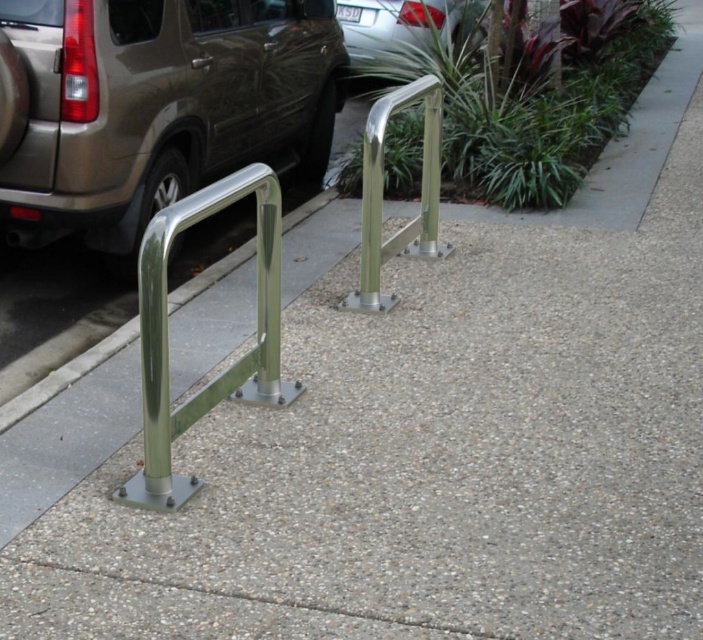
Does polished stainless steel bike rack at center appear on the right side of polished stainless steel handrail at center?

In fact, polished stainless steel bike rack at center is to the left of polished stainless steel handrail at center.

Which is in front, point (146, 282) or point (446, 244)?

Point (146, 282)

You are a GUI agent. You are given a task and a screenshot of the screen. Output one action in this format:
    pyautogui.click(x=<x>, y=<y>)
    Task: Click on the polished stainless steel bike rack at center
    This screenshot has width=703, height=640.
    Given the screenshot: What is the action you would take?
    pyautogui.click(x=167, y=333)

Between point (11, 72) and point (153, 376), which one is positioned in front?

Point (153, 376) is in front.

Who is positioned more to the right, satin silver minivan at left or polished stainless steel bike rack at center?

polished stainless steel bike rack at center is more to the right.

Where is `satin silver minivan at left`? This screenshot has height=640, width=703. satin silver minivan at left is located at coordinates (154, 106).

How distant is polished stainless steel bike rack at center from silver metallic car at upper center?

polished stainless steel bike rack at center and silver metallic car at upper center are 4.96 meters apart from each other.

From the picture: Is polished stainless steel bike rack at center further to camera compared to silver metallic car at upper center?

No, polished stainless steel bike rack at center is in front of silver metallic car at upper center.

Find the location of a particular element. polished stainless steel bike rack at center is located at coordinates (167, 333).

At what (x,y) coordinates should I click in order to perform the action: click on polished stainless steel bike rack at center. Please return your answer as a coordinate pair (x, y). This screenshot has height=640, width=703. Looking at the image, I should click on (167, 333).